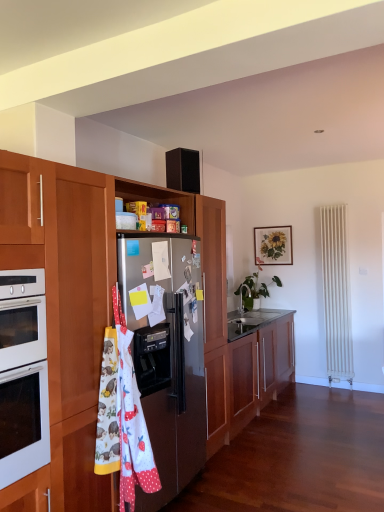
Identify the location of free space on the front side of wooden cabinet at center, which is the first cabinetry from bottom to top. (299, 451).